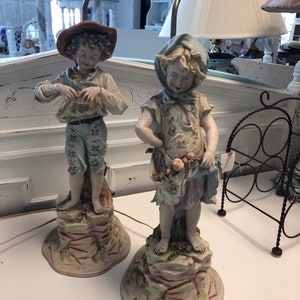
Where is `white lamp shade`? Image resolution: width=300 pixels, height=300 pixels. white lamp shade is located at coordinates (228, 10).